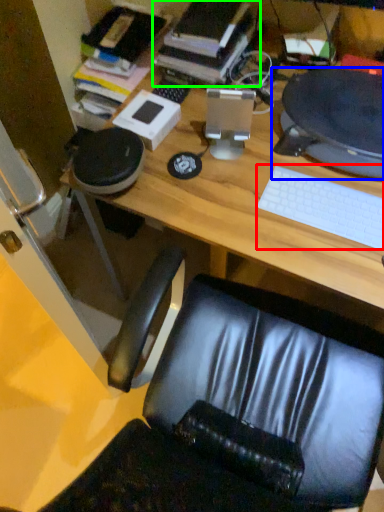
Question: Based on their relative distances, which object is farther from keyboard (highlighted by a red box)? Choose from desktop computer (highlighted by a blue box) and book (highlighted by a green box).

Choices:
 (A) desktop computer
 (B) book

Answer: (B)